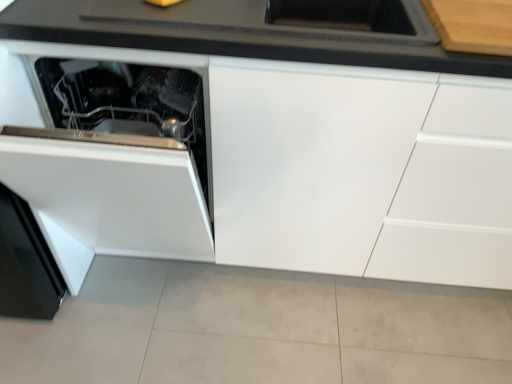
You are a GUI agent. You are given a task and a screenshot of the screen. Output one action in this format:
    pyautogui.click(x=<x>, y=<y>)
    Task: Click on the white glossy oven at lower left
    This screenshot has width=512, height=384.
    Given the screenshot: What is the action you would take?
    pyautogui.click(x=117, y=155)

The height and width of the screenshot is (384, 512). I want to click on white glossy cabinet at center, so click(x=283, y=172).

From a real-world perspective, between white glossy cabinet at center and white glossy oven at lower left, who is vertically lower?

white glossy cabinet at center.

Which object is wider, white glossy cabinet at center or white glossy oven at lower left?

white glossy oven at lower left is wider.

In the scene shown: Does white glossy cabinet at center turn towards white glossy oven at lower left?

Yes, white glossy cabinet at center faces towards white glossy oven at lower left.

This screenshot has height=384, width=512. Find the location of `oven that appears below the white glossy cabinet at center (from the image's perspective)`. oven that appears below the white glossy cabinet at center (from the image's perspective) is located at coordinates (117, 155).

Which of these two, white glossy oven at lower left or white glossy cabinet at center, stands taller?

white glossy cabinet at center is taller.

Which object is more forward, white glossy oven at lower left or white glossy cabinet at center?

white glossy oven at lower left.

Can you see white glossy oven at lower left touching white glossy cabinet at center?

No, white glossy oven at lower left is not next to white glossy cabinet at center.

From the image's perspective, does black matte countertop at upper center appear lower than white glossy oven at lower left?

No, from the image's perspective, black matte countertop at upper center is not beneath white glossy oven at lower left.

How far apart are black matte countertop at upper center and white glossy oven at lower left?

black matte countertop at upper center is 34.40 centimeters from white glossy oven at lower left.

Is black matte countertop at upper center taller than white glossy oven at lower left?

Incorrect, the height of black matte countertop at upper center is not larger of that of white glossy oven at lower left.

Which object is thinner, black matte countertop at upper center or white glossy oven at lower left?

black matte countertop at upper center is thinner.

Can black matte countertop at upper center be found inside white glossy cabinet at center?

Yes, black matte countertop at upper center is a part of white glossy cabinet at center.

In the scene shown: From the image's perspective, who appears lower, white glossy cabinet at center or black matte countertop at upper center?

white glossy cabinet at center, from the image's perspective.

Does point (313, 216) appear closer or farther from the camera than point (103, 20)?

Point (313, 216) appears to be farther away from the viewer than point (103, 20).

In the scene shown: Considering the sizes of objects white glossy cabinet at center and black matte countertop at upper center in the image provided, who is taller, white glossy cabinet at center or black matte countertop at upper center?

white glossy cabinet at center is taller.

Which is more to the right, black matte countertop at upper center or white glossy cabinet at center?

white glossy cabinet at center is more to the right.

Considering the positions of point (323, 16) and point (401, 171), is point (323, 16) closer or farther from the camera than point (401, 171)?

Point (323, 16) appears to be farther away from the viewer than point (401, 171).

Does black matte countertop at upper center turn towards white glossy cabinet at center?

Yes, black matte countertop at upper center is turned towards white glossy cabinet at center.

Is black matte countertop at upper center far away from white glossy cabinet at center?

That's not correct — black matte countertop at upper center is a little close to white glossy cabinet at center.

How different are the orientations of white glossy oven at lower left and black matte countertop at upper center in degrees?

The angle between the facing direction of white glossy oven at lower left and the facing direction of black matte countertop at upper center is 0.0993 degrees.

Is white glossy oven at lower left oriented away from black matte countertop at upper center?

No, white glossy oven at lower left's orientation is not away from black matte countertop at upper center.

Is point (113, 176) in front of point (361, 5)?

Yes, it is.

Is white glossy oven at lower left further to the viewer compared to black matte countertop at upper center?

That is False.

This screenshot has width=512, height=384. Identify the location of oven that is on the left side of white glossy cabinet at center. coord(117,155).

Find the location of a particular element. This screenshot has height=384, width=512. oven that is in front of the white glossy cabinet at center is located at coordinates (117, 155).

Estimate the real-world distances between objects in this image. Which object is closer to white glossy oven at lower left, black matte countertop at upper center or white glossy cabinet at center?

Among the two, white glossy cabinet at center is located nearer to white glossy oven at lower left.

Estimate the real-world distances between objects in this image. Which object is closer to white glossy cabinet at center, black matte countertop at upper center or white glossy oven at lower left?

white glossy oven at lower left.

Looking at the image, which one is located further to black matte countertop at upper center, white glossy cabinet at center or white glossy oven at lower left?

Among the two, white glossy oven at lower left is located further to black matte countertop at upper center.

From the picture: From the image, which object appears to be farther from white glossy oven at lower left, white glossy cabinet at center or black matte countertop at upper center?

black matte countertop at upper center is positioned further to the anchor white glossy oven at lower left.

When comparing their distances from white glossy cabinet at center, does white glossy oven at lower left or black matte countertop at upper center seem closer?

Among the two, white glossy oven at lower left is located nearer to white glossy cabinet at center.

Considering their positions, is white glossy oven at lower left positioned closer to black matte countertop at upper center than white glossy cabinet at center?

white glossy cabinet at center lies closer to black matte countertop at upper center than the other object.

The width and height of the screenshot is (512, 384). Identify the location of countertop between white glossy oven at lower left and white glossy cabinet at center from left to right. (255, 31).